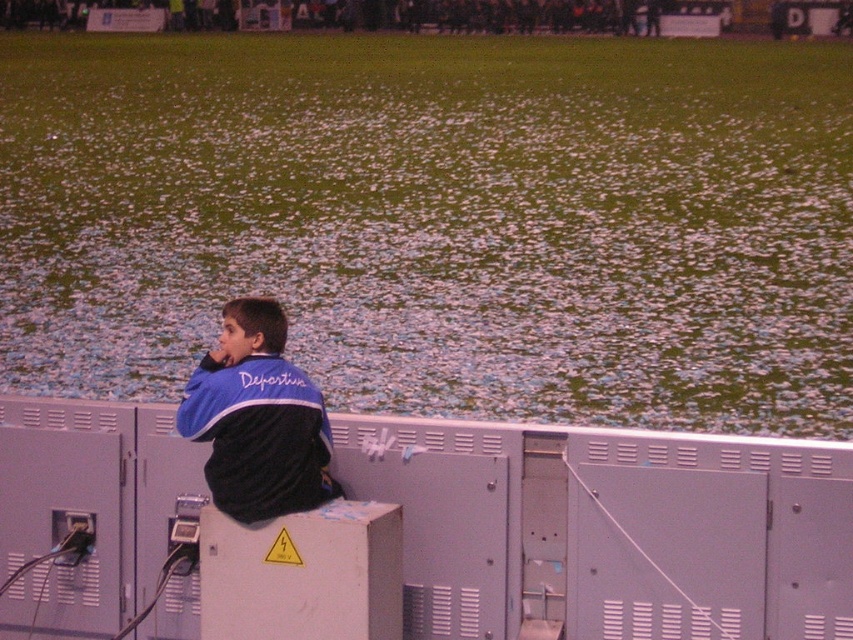
Is green grass at center above blue fleece jacket at upper left?

Yes, green grass at center is above blue fleece jacket at upper left.

Looking at this image, who is positioned more to the right, green grass at center or blue fleece jacket at upper left?

Positioned to the right is green grass at center.

Does point (399, 211) come closer to viewer compared to point (245, 422)?

No, (399, 211) is behind (245, 422).

You are a GUI agent. You are given a task and a screenshot of the screen. Output one action in this format:
    pyautogui.click(x=<x>, y=<y>)
    Task: Click on the green grass at center
    The image size is (853, 640).
    Given the screenshot: What is the action you would take?
    pyautogui.click(x=438, y=220)